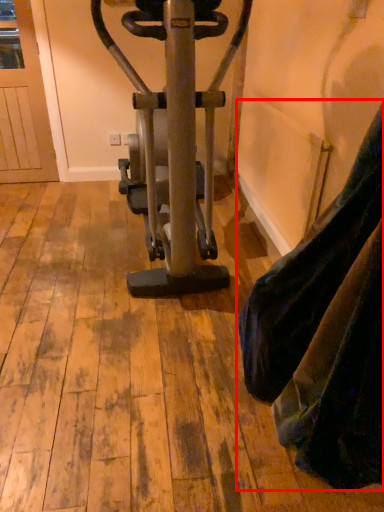
Question: From the image's perspective, considering the relative positions of tight (annotated by the red box) and stationary bicycle in the image provided, where is tight (annotated by the red box) located with respect to the staircase?

Choices:
 (A) above
 (B) below

Answer: (B)